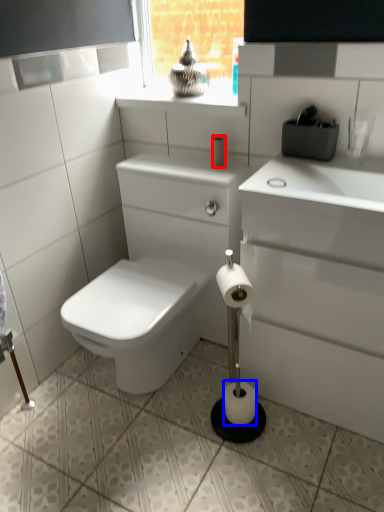
Question: Among these objects, which one is farthest to the camera, toilet paper (highlighted by a red box) or toilet paper (highlighted by a blue box)?

Choices:
 (A) toilet paper
 (B) toilet paper

Answer: (A)